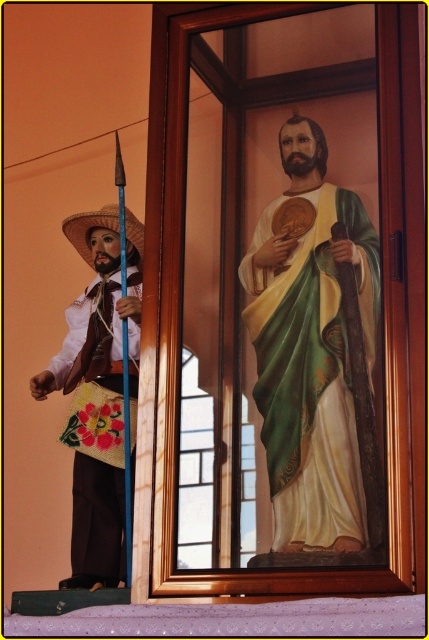
You are an interior designer arranging items on a shelf. You have a matte green robe at center and an embroidered fabric purse at left. Based on the scene description, which item should be placed to the right of the other to match the original image?

The matte green robe at center should be placed to the right of the embroidered fabric purse at left to match the original image, as the matte green robe at center is positioned on the right side of the embroidered fabric purse at left in the scene.

Based on the photo, you are a delivery person who needs to place a package between the matte green robe at center and the embroidered fabric purse at left. The package requires 1.5 meters of space. Can you fit it there?

The distance between the matte green robe at center and the embroidered fabric purse at left is 1.71 meters, which is more than enough to fit the package requiring 1.5 meters of space.

You are standing in front of the image and want to determine which of the two points, point (x=365, y=240) or point (x=72, y=220), is nearer to you. Based on the scene, can you identify which point is closer?

Point (x=365, y=240) is closer to the camera than point (x=72, y=220), so the point (x=365, y=240) is closer to you.